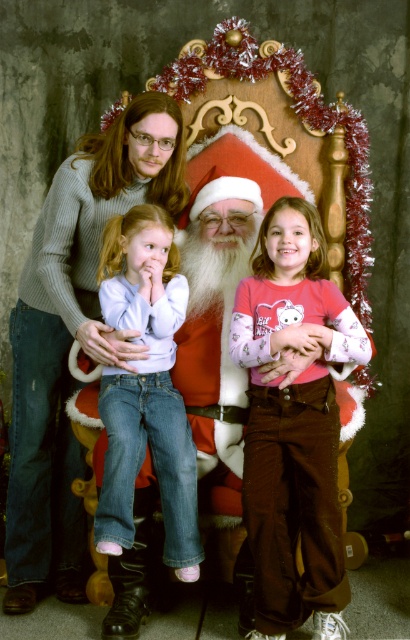
You are standing in front of the festive scene and want to take a photo of the pink cotton shirt at center. Where should you aim your camera to capture it?

The pink cotton shirt at center is located at the coordinates point (293, 422), so aim your camera towards that point to capture it.

You are a photographer setting up for a Christmas photo shoot. You need to position a pink cotton shirt at center and denim jeans at center so that they are aligned properly. According to the scene, which clothing item should be placed to the right side?

The pink cotton shirt at center should be placed to the right of the denim jeans at center as per the scene description.